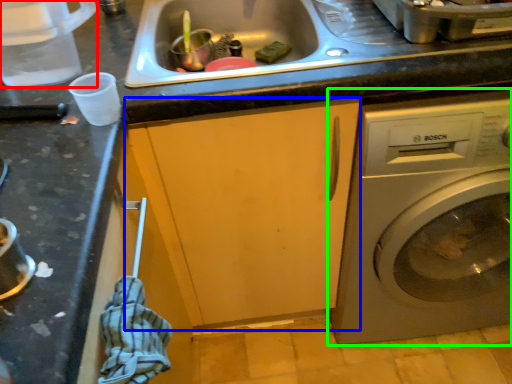
Question: Considering the real-world distances, which object is closest to appliance (highlighted by a red box)? cabinetry (highlighted by a blue box) or washing machine (highlighted by a green box).

Choices:
 (A) cabinetry
 (B) washing machine

Answer: (A)